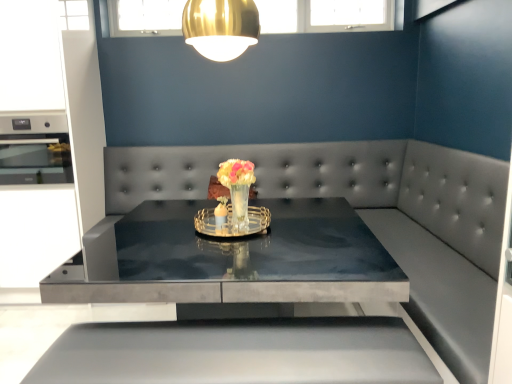
Where is `translucent glass vase at center, arranged as the 2th floral arrangement when viewed from the back`? translucent glass vase at center, arranged as the 2th floral arrangement when viewed from the back is located at coordinates (238, 190).

In order to face smooth gray couch at center, should I rotate leftwards or rightwards?

Turn left approximately 0.941 degrees to face it.

Measure the distance between smooth gray couch at center and camera.

They are 1.30 meters apart.

Identify the location of matte black oven at left. 35,150.

Does gold metallic lampshade at upper center have a greater width compared to translucent glass vase at center, positioned as the 2th floral arrangement in front-to-back order?

No, gold metallic lampshade at upper center is not wider than translucent glass vase at center, positioned as the 2th floral arrangement in front-to-back order.

Is point (253, 9) closer or farther from the camera than point (218, 230)?

Point (253, 9) appears to be closer to the viewer than point (218, 230).

Looking at this image, from the image's perspective, between gold metallic lampshade at upper center and translucent glass vase at center, positioned as the 2th floral arrangement in front-to-back order, which one is located above?

gold metallic lampshade at upper center appears higher in the image.

Is gold metallic lampshade at upper center taller or shorter than translucent glass vase at center, positioned as the 2th floral arrangement in front-to-back order?

gold metallic lampshade at upper center is taller than translucent glass vase at center, positioned as the 2th floral arrangement in front-to-back order.

Which point is more forward, (88, 234) or (234, 38)?

The point (234, 38) is closer to the camera.

How different are the orientations of smooth gray couch at center and gold metallic lampshade at upper center in degrees?

They differ by 2.6 degrees in their facing directions.

Does smooth gray couch at center have a lesser width compared to gold metallic lampshade at upper center?

No, smooth gray couch at center is not thinner than gold metallic lampshade at upper center.

Between smooth gray couch at center and gold metallic lampshade at upper center, which one appears on the right side from the viewer's perspective?

From the viewer's perspective, smooth gray couch at center appears more on the right side.

From the image's perspective, which one is positioned higher, translucent glass vase at center, positioned as the 2th floral arrangement in front-to-back order, or smooth gray couch at center?

translucent glass vase at center, positioned as the 2th floral arrangement in front-to-back order, from the image's perspective.

Measure the distance between translucent glass vase at center, which is the first floral arrangement from back to front, and smooth gray couch at center.

translucent glass vase at center, which is the first floral arrangement from back to front, is 24.73 inches away from smooth gray couch at center.

Is translucent glass vase at center, which is the first floral arrangement from back to front, touching smooth gray couch at center?

translucent glass vase at center, which is the first floral arrangement from back to front, and smooth gray couch at center are clearly separated.

Is smooth gray couch at center a part of translucent glass vase at center, which is the first floral arrangement from back to front?

Actually, smooth gray couch at center is outside translucent glass vase at center, which is the first floral arrangement from back to front.

Is matte black oven at left oriented away from translucent glass vase at center, positioned as the 2th floral arrangement in front-to-back order?

No, matte black oven at left's orientation is not away from translucent glass vase at center, positioned as the 2th floral arrangement in front-to-back order.

Are matte black oven at left and translucent glass vase at center, positioned as the 2th floral arrangement in front-to-back order, far apart?

Absolutely, matte black oven at left is distant from translucent glass vase at center, positioned as the 2th floral arrangement in front-to-back order.

Considering the relative sizes of matte black oven at left and translucent glass vase at center, positioned as the 2th floral arrangement in front-to-back order, in the image provided, is matte black oven at left wider than translucent glass vase at center, positioned as the 2th floral arrangement in front-to-back order,?

Yes, matte black oven at left is wider than translucent glass vase at center, positioned as the 2th floral arrangement in front-to-back order.

Looking at this image, from the image's perspective, would you say smooth gray couch at center is shown under translucent glass vase at center, placed as the 1th floral arrangement when sorted from front to back?

Correct, smooth gray couch at center appears lower than translucent glass vase at center, placed as the 1th floral arrangement when sorted from front to back, in the image.

Is smooth gray couch at center far away from translucent glass vase at center, arranged as the 2th floral arrangement when viewed from the back?

No, smooth gray couch at center is not far from translucent glass vase at center, arranged as the 2th floral arrangement when viewed from the back.

Is smooth gray couch at center in front of or behind translucent glass vase at center, placed as the 1th floral arrangement when sorted from front to back, in the image?

smooth gray couch at center is in front of translucent glass vase at center, placed as the 1th floral arrangement when sorted from front to back.

Considering the sizes of objects smooth gray couch at center and translucent glass vase at center, placed as the 1th floral arrangement when sorted from front to back, in the image provided, who is wider, smooth gray couch at center or translucent glass vase at center, placed as the 1th floral arrangement when sorted from front to back,?

With larger width is smooth gray couch at center.

From the image's perspective, which one is positioned higher, translucent glass vase at center, arranged as the 2th floral arrangement when viewed from the back, or gold metallic lampshade at upper center?

From the image's view, gold metallic lampshade at upper center is above.

Based on the photo, in the image, is translucent glass vase at center, arranged as the 2th floral arrangement when viewed from the back, positioned in front of or behind gold metallic lampshade at upper center?

translucent glass vase at center, arranged as the 2th floral arrangement when viewed from the back, is behind gold metallic lampshade at upper center.

Is gold metallic lampshade at upper center completely or partially inside translucent glass vase at center, placed as the 1th floral arrangement when sorted from front to back?

No, gold metallic lampshade at upper center is located outside of translucent glass vase at center, placed as the 1th floral arrangement when sorted from front to back.

Can you confirm if translucent glass vase at center, arranged as the 2th floral arrangement when viewed from the back, is positioned to the right of gold metallic lampshade at upper center?

Yes, translucent glass vase at center, arranged as the 2th floral arrangement when viewed from the back, is to the right of gold metallic lampshade at upper center.

Considering the sizes of gold metallic lampshade at upper center and translucent glass vase at center, placed as the 1th floral arrangement when sorted from front to back, in the image, is gold metallic lampshade at upper center wider or thinner than translucent glass vase at center, placed as the 1th floral arrangement when sorted from front to back,?

gold metallic lampshade at upper center is wider than translucent glass vase at center, placed as the 1th floral arrangement when sorted from front to back.

The image size is (512, 384). In order to click on floral arrangement on the right of gold metallic lampshade at upper center in this screenshot , I will do `click(238, 190)`.

Which is nearer, (202, 47) or (241, 217)?

Point (202, 47) appears to be closer to the viewer than point (241, 217).

Is gold metallic lampshade at upper center taller than translucent glass vase at center, placed as the 1th floral arrangement when sorted from front to back?

Incorrect, the height of gold metallic lampshade at upper center is not larger of that of translucent glass vase at center, placed as the 1th floral arrangement when sorted from front to back.

There is a gold metallic lampshade at upper center. Identify the location of the 2nd floral arrangement below it (from a real-world perspective). (234, 204).

Where is `lamp that is above the smooth gray couch at center (from a real-world perspective)`? The image size is (512, 384). lamp that is above the smooth gray couch at center (from a real-world perspective) is located at coordinates (220, 27).

Looking at the image, which one is located closer to translucent glass vase at center, which is the first floral arrangement from back to front, matte black oven at left or translucent glass vase at center, placed as the 1th floral arrangement when sorted from front to back?

translucent glass vase at center, placed as the 1th floral arrangement when sorted from front to back, lies closer to translucent glass vase at center, which is the first floral arrangement from back to front, than the other object.

Looking at the image, which one is located further to translucent glass vase at center, positioned as the 2th floral arrangement in front-to-back order, smooth gray couch at center or translucent glass vase at center, arranged as the 2th floral arrangement when viewed from the back?

smooth gray couch at center.

Looking at the image, which one is located closer to smooth gray couch at center, translucent glass vase at center, positioned as the 2th floral arrangement in front-to-back order, or translucent glass vase at center, placed as the 1th floral arrangement when sorted from front to back?

Based on the image, translucent glass vase at center, positioned as the 2th floral arrangement in front-to-back order, appears to be nearer to smooth gray couch at center.

Which object lies further to the anchor point smooth gray couch at center, translucent glass vase at center, positioned as the 2th floral arrangement in front-to-back order, or matte black oven at left?

Among the two, matte black oven at left is located further to smooth gray couch at center.

Looking at the image, which one is located closer to matte black oven at left, translucent glass vase at center, placed as the 1th floral arrangement when sorted from front to back, or translucent glass vase at center, which is the first floral arrangement from back to front?

The object closer to matte black oven at left is translucent glass vase at center, which is the first floral arrangement from back to front.

Considering their positions, is translucent glass vase at center, positioned as the 2th floral arrangement in front-to-back order, positioned further to translucent glass vase at center, placed as the 1th floral arrangement when sorted from front to back, than gold metallic lampshade at upper center?

Among the two, gold metallic lampshade at upper center is located further to translucent glass vase at center, placed as the 1th floral arrangement when sorted from front to back.

Estimate the real-world distances between objects in this image. Which object is closer to smooth gray couch at center, gold metallic lampshade at upper center or matte black oven at left?

gold metallic lampshade at upper center is positioned closer to the anchor smooth gray couch at center.

When comparing their distances from translucent glass vase at center, arranged as the 2th floral arrangement when viewed from the back, does gold metallic lampshade at upper center or smooth gray couch at center seem further?

Based on the image, smooth gray couch at center appears to be further to translucent glass vase at center, arranged as the 2th floral arrangement when viewed from the back.

Locate an element on the screen. The height and width of the screenshot is (384, 512). lamp between matte black oven at left and smooth gray couch at center is located at coordinates (220, 27).

This screenshot has width=512, height=384. In order to click on floral arrangement between matte black oven at left and gold metallic lampshade at upper center in this screenshot , I will do `click(234, 204)`.

Identify the location of floral arrangement between matte black oven at left and translucent glass vase at center, placed as the 1th floral arrangement when sorted from front to back. (234, 204).

Where is `lamp between smooth gray couch at center and translucent glass vase at center, which is the first floral arrangement from back to front, in the front-back direction`? lamp between smooth gray couch at center and translucent glass vase at center, which is the first floral arrangement from back to front, in the front-back direction is located at coordinates (220, 27).